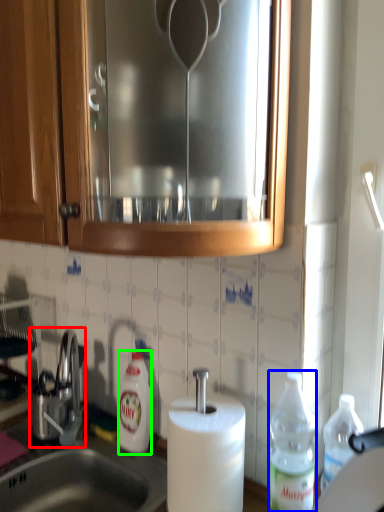
Question: Considering the real-world distances, which object is closest to tap (highlighted by a red box)? bottle (highlighted by a blue box) or bottle (highlighted by a green box).

Choices:
 (A) bottle
 (B) bottle

Answer: (B)